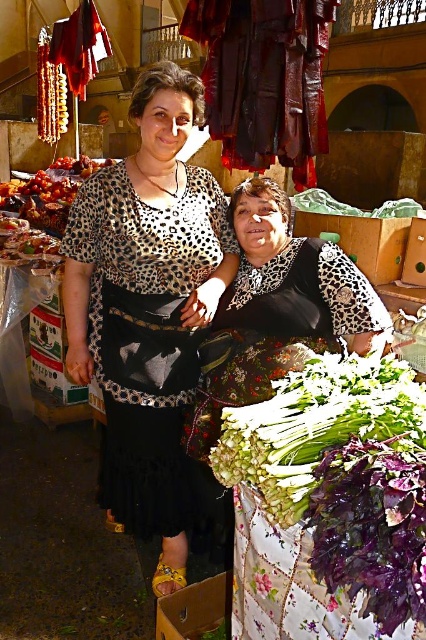
You are a customer at the market and want to grab the green leafy vegetables at lower right. However, there is a leopard print blouse at center in your way. Can you reach the vegetables without moving the blouse?

The green leafy vegetables at lower right is behind leopard print blouse at center, so you can reach the vegetables without moving the blouse since they are positioned behind it.

You are a customer at the market and you want to find the leopard print blouse at center. Where should you look relative to the green leafy vegetables at lower right?

The leopard print blouse at center is much taller than the green leafy vegetables at lower right, so you should look upwards from the green leafy vegetables at lower right to find it.

You are a customer at the market and want to buy the green leafy vegetables at lower right. Which direction should you move relative to the leopard print blouse at center?

The leopard print blouse at center is positioned on the left side of green leafy vegetables at lower right, so you should move to the right relative to the leopard print blouse at center to reach the green leafy vegetables at lower right.